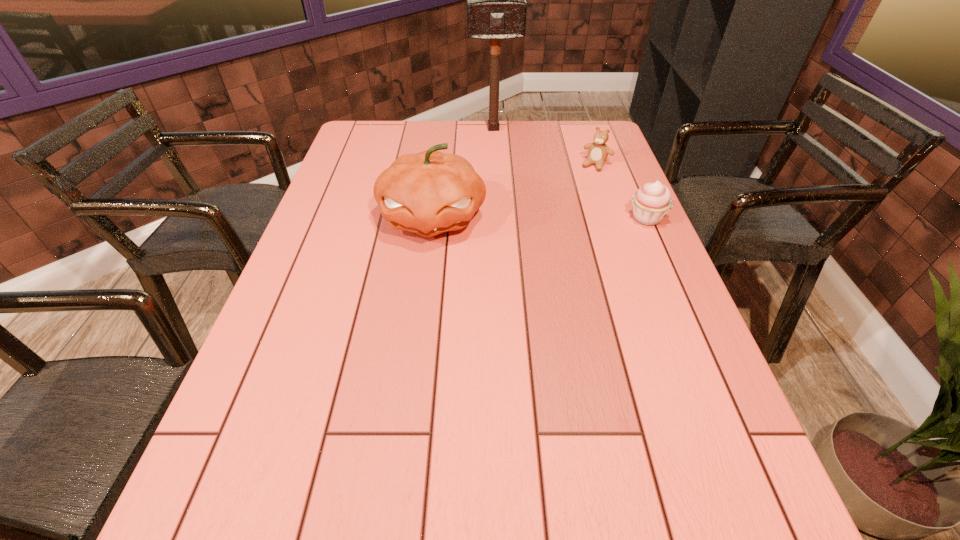
Identify the location of vacant point located between the tallest object and the cupcake. This screenshot has height=540, width=960. (570, 173).

Locate an element on the screen. This screenshot has height=540, width=960. free space between the cupcake and the mallet is located at coordinates (570, 173).

Locate an element on the screen. The image size is (960, 540). unoccupied position between the third shortest object and the second farthest object is located at coordinates (515, 191).

Locate an element on the screen. This screenshot has height=540, width=960. free space between the cupcake and the second farthest object is located at coordinates (621, 192).

The height and width of the screenshot is (540, 960). Identify the location of free spot between the third shortest object and the third nearest object. (515, 191).

What are the coordinates of `free space between the tallest object and the second farthest object` in the screenshot? It's located at (544, 147).

Locate an element on the screen. This screenshot has width=960, height=540. vacant area that lies between the third shortest object and the third nearest object is located at coordinates (515, 191).

You are a GUI agent. You are given a task and a screenshot of the screen. Output one action in this format:
    pyautogui.click(x=<x>, y=<y>)
    Task: Click on the empty location between the cupcake and the second farthest object
    
    Given the screenshot: What is the action you would take?
    pyautogui.click(x=621, y=192)

Locate an element on the screen. The height and width of the screenshot is (540, 960). free space between the pumpkin and the teddy bear is located at coordinates (515, 191).

Where is `vacant area that lies between the pumpkin and the cupcake`? vacant area that lies between the pumpkin and the cupcake is located at coordinates (540, 218).